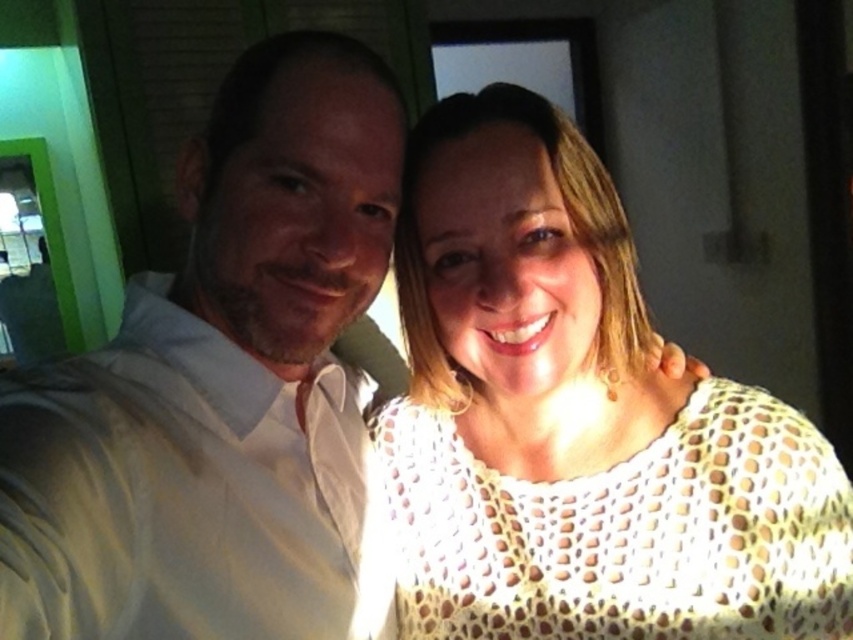
You are a fashion designer trying to decide which outfit to recommend for a client who wants something with a relaxed fit. Based on the image, which item has a wider silhouette between the white crochet top at center and the white smooth shirt at left?

The white crochet top at center has a wider silhouette than the white smooth shirt at left, making it a better choice for a relaxed fit.

You are a photographer setting up a shoot in a room with green walls. You need to position a camera so that both the white crochet top at center and the white smooth shirt at left are in focus. Which object should be closer to the camera to ensure both are sharp?

The white crochet top at center is closer to the camera than the white smooth shirt at left, so positioning the camera to focus on the white crochet top at center will help keep both in focus since it is nearer.

You are a photographer setting up for a photoshoot and need to decide which garment to use based on size. Given the white crochet top at center and the white smooth shirt at left, which one should you choose if you want the larger garment for a model?

The white smooth shirt at left is larger than the white crochet top at center, so you should choose the white smooth shirt at left for the larger garment.